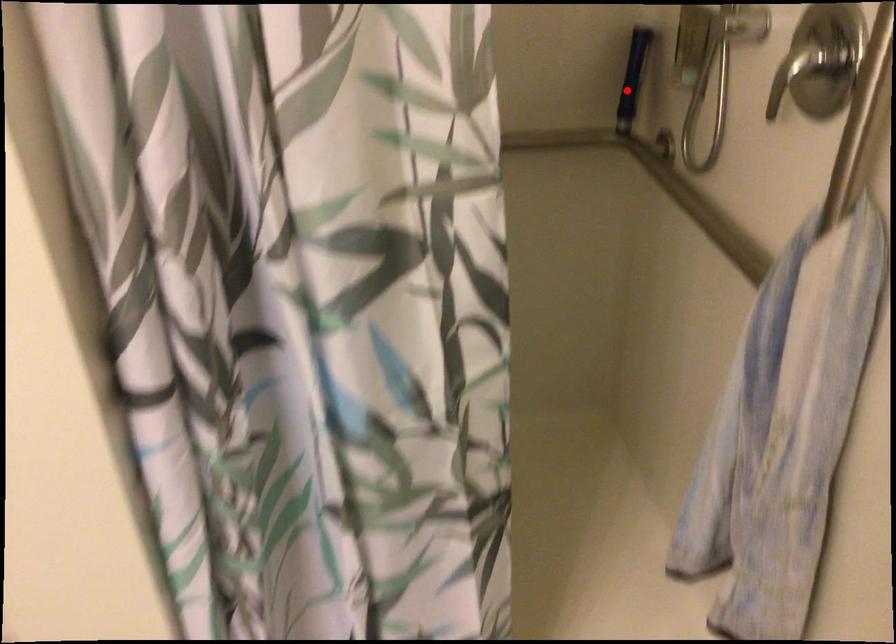
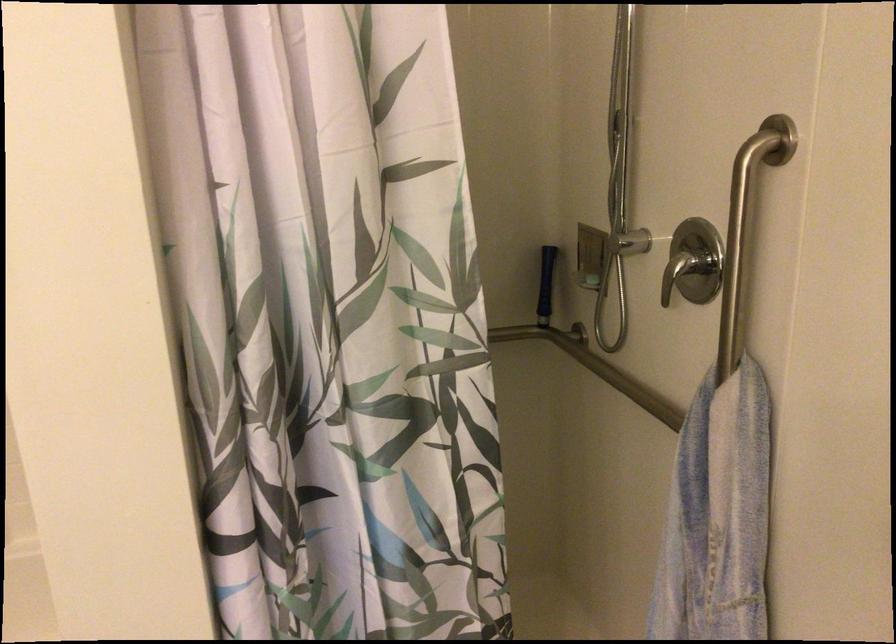
The point at the highlighted location is marked in the first image. Where is the corresponding point in the second image?

(546, 285)